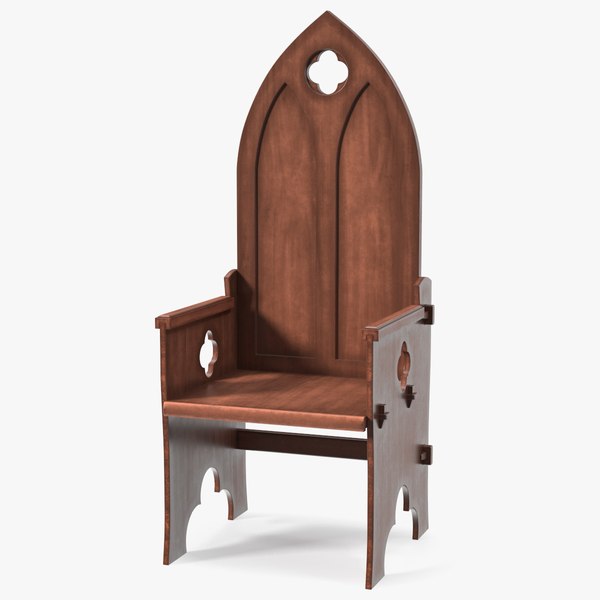
Locate an element on the screen. indentations in back rest is located at coordinates (280, 182), (367, 199).